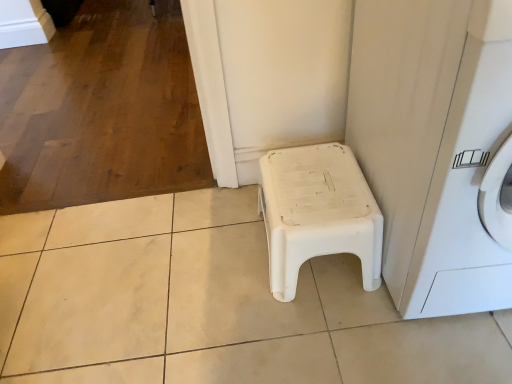
I want to click on vacant area that lies in front of white plastic stool at center, so click(332, 338).